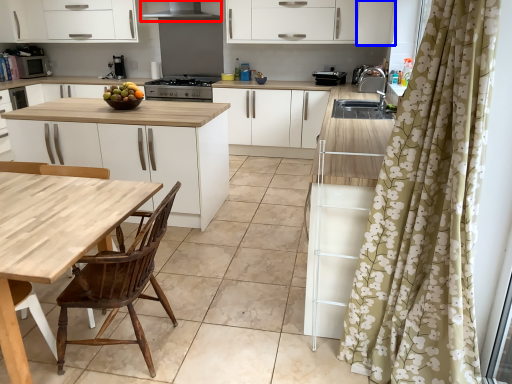
Question: Which point is closer to the camera, exhaust hood (highlighted by a red box) or cabinetry (highlighted by a blue box)?

Choices:
 (A) exhaust hood
 (B) cabinetry

Answer: (B)